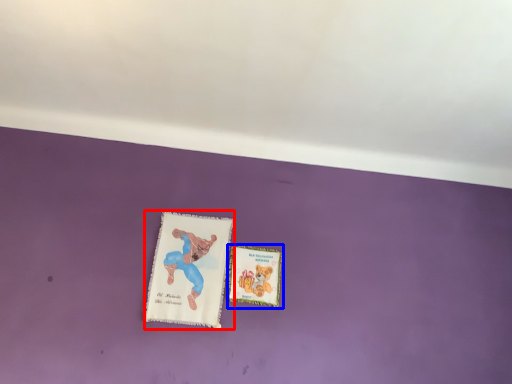
Question: Which object is closer to the camera taking this photo, paperback book (highlighted by a red box) or paperback book (highlighted by a blue box)?

Choices:
 (A) paperback book
 (B) paperback book

Answer: (A)